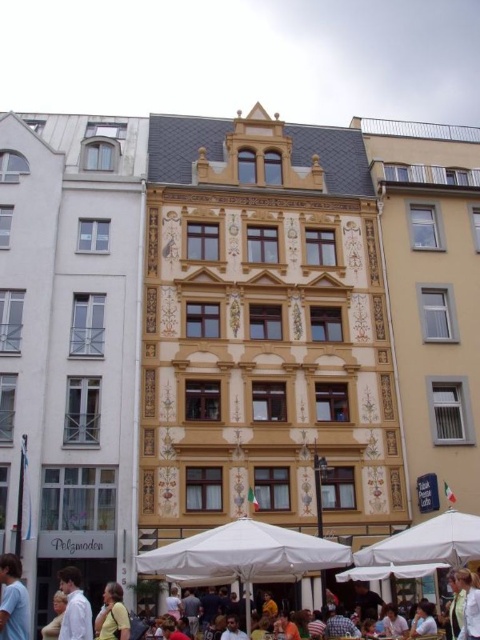
Does white fabric umbrella at lower center lie in front of white shirt at lower left?

That is False.

Identify the location of white fabric umbrella at lower center. Image resolution: width=480 pixels, height=640 pixels. (243, 556).

Find the location of `white fabric umbrella at lower center`. white fabric umbrella at lower center is located at coordinates 243,556.

From the picture: Between white shirt at lower left and yellow shirt at lower center, which one has more height?

Standing taller between the two is yellow shirt at lower center.

Is point (64, 609) in front of point (115, 627)?

No, (64, 609) is behind (115, 627).

You are a GUI agent. You are given a task and a screenshot of the screen. Output one action in this format:
    pyautogui.click(x=<x>, y=<y>)
    Task: Click on the white shirt at lower left
    
    Given the screenshot: What is the action you would take?
    pyautogui.click(x=74, y=605)

Measure the distance between point (268,541) and camera.

101.94 feet

Is white fabric umbrella at lower center wider than yellow shirt at lower center?

Yes.

At what (x,y) coordinates should I click in order to perform the action: click on white fabric umbrella at lower center. Please return your answer as a coordinate pair (x, y). Looking at the image, I should click on (243, 556).

At what (x,y) coordinates should I click in order to perform the action: click on white fabric umbrella at lower center. Please return your answer as a coordinate pair (x, y). Looking at the image, I should click on (243, 556).